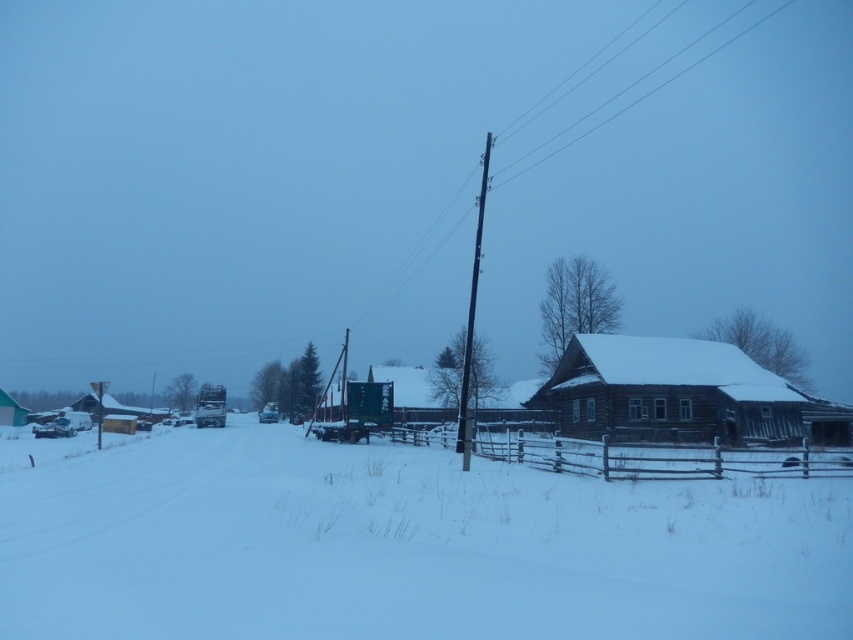
Question: Is white powdery snow at center to the right of wooden cabin at right from the viewer's perspective?

Choices:
 (A) no
 (B) yes

Answer: (A)

Question: Does wooden cabin at right appear on the left side of black wooden pole at center?

Choices:
 (A) yes
 (B) no

Answer: (B)

Question: Estimate the real-world distances between objects in this image. Which object is closer to the wooden cabin at right?

Choices:
 (A) white powdery snow at center
 (B) black wooden pole at center

Answer: (B)

Question: Which object is positioned farthest from the black wooden pole at center?

Choices:
 (A) white powdery snow at center
 (B) wooden cabin at right

Answer: (B)

Question: Can you confirm if white powdery snow at center is positioned to the left of wooden cabin at right?

Choices:
 (A) no
 (B) yes

Answer: (B)

Question: Which of the following is the closest to the observer?

Choices:
 (A) black wooden pole at center
 (B) wooden cabin at right

Answer: (A)